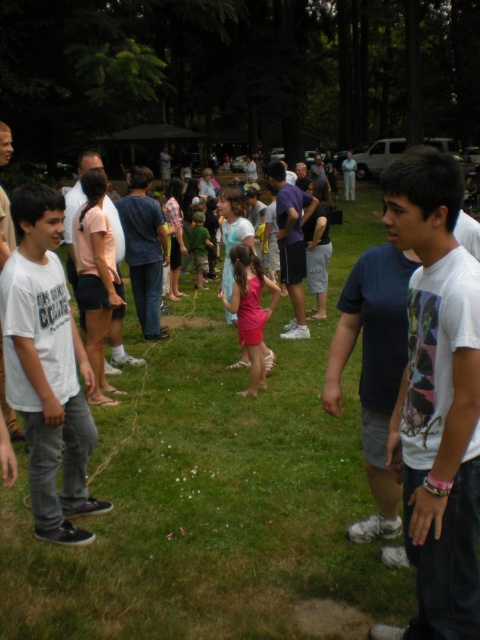
Question: Is pink satin dress at center positioned at the back of green camouflage shirt at center?

Choices:
 (A) yes
 (B) no

Answer: (B)

Question: Considering the real-world distances, which object is closest to the white cotton shirt at left?

Choices:
 (A) pink satin dress at center
 (B) green camouflage shirt at center

Answer: (A)

Question: Is white cotton shirt at left further to the viewer compared to pink satin dress at center?

Choices:
 (A) yes
 (B) no

Answer: (B)

Question: Which object appears farthest from the camera in this image?

Choices:
 (A) pink satin dress at center
 (B) green camouflage shirt at center
 (C) white cotton shirt at left

Answer: (B)

Question: Can you confirm if white cotton shirt at left is positioned above green camouflage shirt at center?

Choices:
 (A) yes
 (B) no

Answer: (B)

Question: Which point is closer to the camera?

Choices:
 (A) pink satin dress at center
 (B) green camouflage shirt at center
 (C) white cotton shirt at left

Answer: (C)